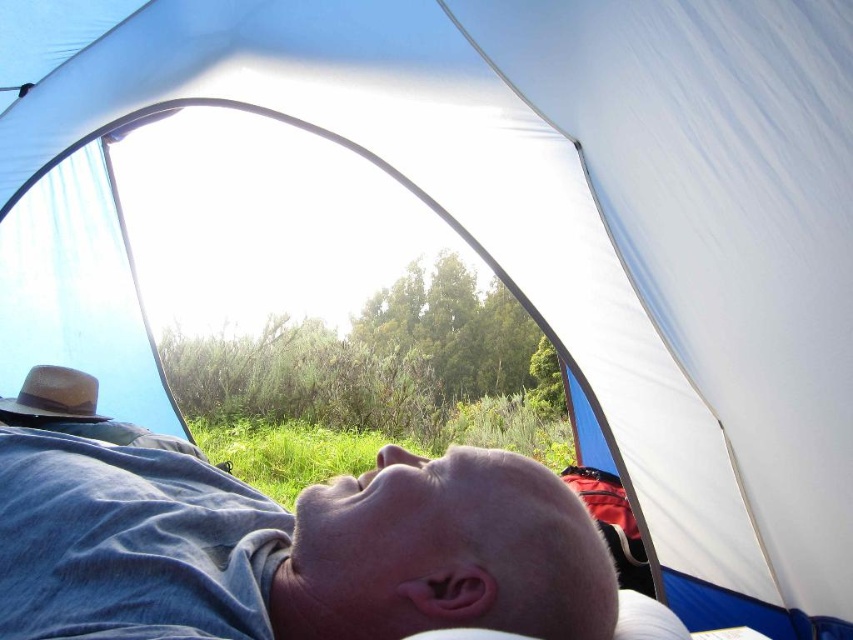
You are a photographer setting up a camera inside the tent. You want to capture a photo of the smooth skin head at lower center and the brown straw hat at left. What is the minimum distance you need to set your camera lens to ensure both objects are in frame?

The minimum distance required is 4.54 feet, as the smooth skin head at lower center and brown straw hat at left are separated by that distance, so the camera lens must accommodate this span to include both in the frame.

You are a photographer inside the tent and want to take a clear photo of the smooth skin head at lower center and the brown straw hat at left. However, the hat is partially blocking the view of the head. Can you adjust your position to ensure both are fully visible without any obstruction?

The smooth skin head at lower center is in front of the brown straw hat at left, so moving the camera slightly to the side or adjusting the angle might allow both to be visible without obstruction.

You are a photographer standing outside the tent and want to take a portrait of the person inside. The tent entrance is 17.78 inches wide. Can you fit the smooth skin head at lower center into the frame without moving the tent entrance? Please explain your reasoning.

The smooth skin head at lower center is 17.78 inches apart from the tent entrance. Since the entrance is exactly 17.78 inches wide, the head can fit perfectly within the frame without needing to adjust the entrance.